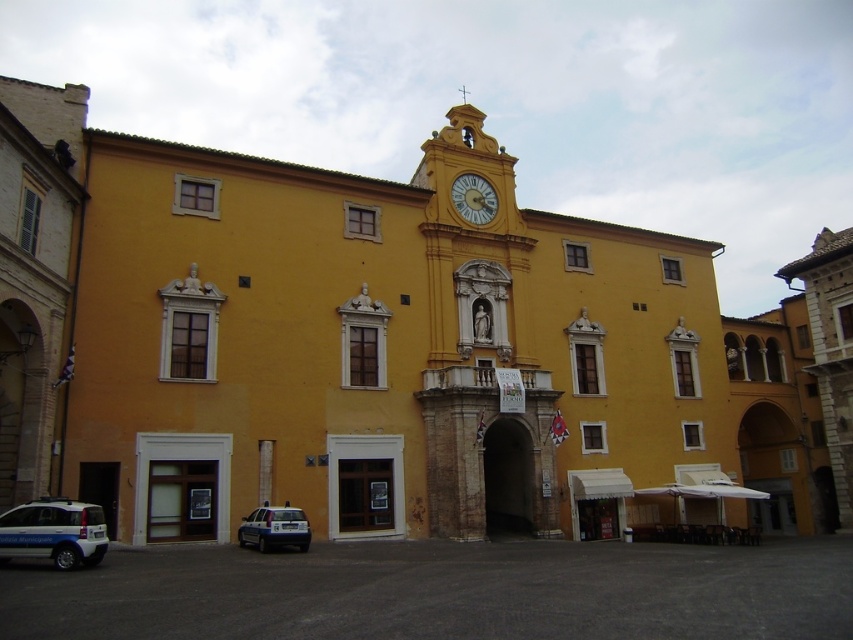
Does white glossy car at lower left appear under golden metallic clock at upper center?

Yes, white glossy car at lower left is below golden metallic clock at upper center.

Is point (90, 529) in front of point (485, 221)?

Yes, it is.

The width and height of the screenshot is (853, 640). I want to click on white glossy car at lower left, so click(x=54, y=532).

This screenshot has height=640, width=853. What do you see at coordinates (54, 532) in the screenshot?
I see `white glossy car at lower left` at bounding box center [54, 532].

Does white glossy car at lower left appear on the right side of white glossy police car at lower left?

No, white glossy car at lower left is not to the right of white glossy police car at lower left.

This screenshot has width=853, height=640. I want to click on white glossy car at lower left, so click(x=54, y=532).

Who is positioned more to the left, white glossy police car at lower left or golden metallic clock at upper center?

From the viewer's perspective, white glossy police car at lower left appears more on the left side.

Is white glossy police car at lower left below golden metallic clock at upper center?

Indeed, white glossy police car at lower left is positioned under golden metallic clock at upper center.

The image size is (853, 640). Describe the element at coordinates (274, 529) in the screenshot. I see `white glossy police car at lower left` at that location.

Where is `white glossy police car at lower left`? The height and width of the screenshot is (640, 853). white glossy police car at lower left is located at coordinates 274,529.